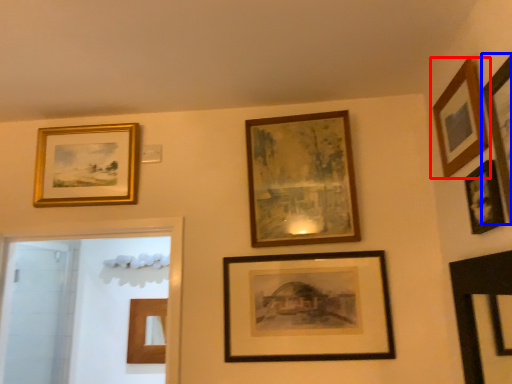
Question: Which of the following is the closest to the observer, picture frame (highlighted by a red box) or picture frame (highlighted by a blue box)?

Choices:
 (A) picture frame
 (B) picture frame

Answer: (B)